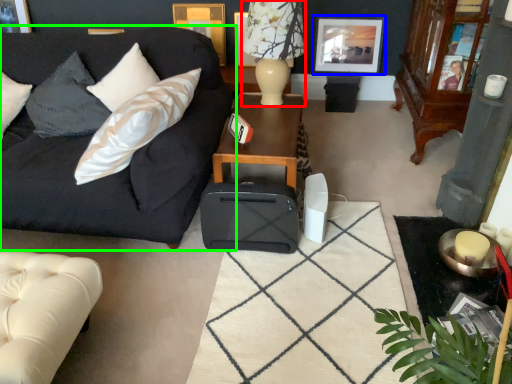
Question: Which is nearer to the lamp (highlighted by a red box)? picture frame (highlighted by a blue box) or studio couch (highlighted by a green box).

Choices:
 (A) picture frame
 (B) studio couch

Answer: (B)